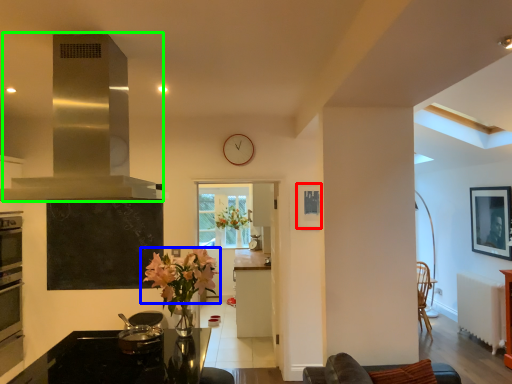
Question: Which is nearer to the picture frame (highlighted by a red box)? flower (highlighted by a blue box) or exhaust hood (highlighted by a green box).

Choices:
 (A) flower
 (B) exhaust hood

Answer: (A)